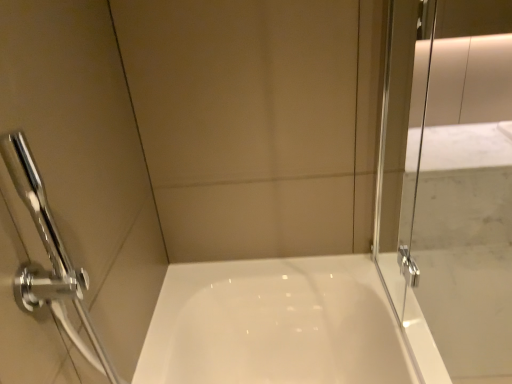
You are a GUI agent. You are given a task and a screenshot of the screen. Output one action in this format:
    pyautogui.click(x=<x>, y=<y>)
    Task: Click on the transparent glass screen door at right
    This screenshot has width=512, height=384.
    Given the screenshot: What is the action you would take?
    coord(448,194)

What do you see at coordinates (448, 194) in the screenshot?
I see `transparent glass screen door at right` at bounding box center [448, 194].

Describe the element at coordinates (49, 256) in the screenshot. This screenshot has height=384, width=512. I see `chrome metallic showerhead at left` at that location.

This screenshot has width=512, height=384. In order to click on chrome metallic showerhead at left in this screenshot , I will do `click(49, 256)`.

Where is `transparent glass screen door at right`? transparent glass screen door at right is located at coordinates (448, 194).

Considering the relative positions of transparent glass screen door at right and chrome metallic showerhead at left in the image provided, is transparent glass screen door at right to the left or to the right of chrome metallic showerhead at left?

Clearly, transparent glass screen door at right is on the right of chrome metallic showerhead at left in the image.

Which object is further away from the camera taking this photo, transparent glass screen door at right or chrome metallic showerhead at left?

chrome metallic showerhead at left is further from the camera.

Which is in front, point (435, 51) or point (42, 272)?

Positioned in front is point (42, 272).

From the image's perspective, is transparent glass screen door at right beneath chrome metallic showerhead at left?

No.

From a real-world perspective, relative to chrome metallic showerhead at left, is transparent glass screen door at right vertically above or below?

Clearly, from a real-world perspective, transparent glass screen door at right is above chrome metallic showerhead at left.

Considering the relative sizes of transparent glass screen door at right and chrome metallic showerhead at left in the image provided, is transparent glass screen door at right wider than chrome metallic showerhead at left?

In fact, transparent glass screen door at right might be narrower than chrome metallic showerhead at left.

In the scene shown: Who is taller, transparent glass screen door at right or chrome metallic showerhead at left?

With more height is transparent glass screen door at right.

Which of these two, transparent glass screen door at right or chrome metallic showerhead at left, is smaller?

chrome metallic showerhead at left is smaller.

Can chrome metallic showerhead at left be found inside transparent glass screen door at right?

No, chrome metallic showerhead at left is not inside transparent glass screen door at right.

Is transparent glass screen door at right next to chrome metallic showerhead at left and touching it?

transparent glass screen door at right is not next to chrome metallic showerhead at left, and they're not touching.

In the scene shown: Is transparent glass screen door at right turned away from chrome metallic showerhead at left?

Yes, chrome metallic showerhead at left is at the back of transparent glass screen door at right.

Find the location of `screen door above the chrome metallic showerhead at left (from the image's perspective)`. screen door above the chrome metallic showerhead at left (from the image's perspective) is located at coordinates (448, 194).

Is chrome metallic showerhead at left at the left side of transparent glass screen door at right?

Indeed, chrome metallic showerhead at left is positioned on the left side of transparent glass screen door at right.

Which object is more forward, chrome metallic showerhead at left or transparent glass screen door at right?

Positioned in front is transparent glass screen door at right.

Considering the positions of point (27, 200) and point (392, 5), is point (27, 200) closer or farther from the camera than point (392, 5)?

Clearly, point (27, 200) is closer to the camera than point (392, 5).

From the image's perspective, which is below, chrome metallic showerhead at left or transparent glass screen door at right?

From the image's view, chrome metallic showerhead at left is below.

From a real-world perspective, between chrome metallic showerhead at left and transparent glass screen door at right, who is vertically lower?

From a 3D spatial view, chrome metallic showerhead at left is below.

Considering the relative sizes of chrome metallic showerhead at left and transparent glass screen door at right in the image provided, is chrome metallic showerhead at left wider than transparent glass screen door at right?

Correct, the width of chrome metallic showerhead at left exceeds that of transparent glass screen door at right.

Considering the sizes of objects chrome metallic showerhead at left and transparent glass screen door at right in the image provided, who is taller, chrome metallic showerhead at left or transparent glass screen door at right?

With more height is transparent glass screen door at right.

Who is bigger, chrome metallic showerhead at left or transparent glass screen door at right?

transparent glass screen door at right is bigger.

Is transparent glass screen door at right surrounded by chrome metallic showerhead at left?

No, transparent glass screen door at right is located outside of chrome metallic showerhead at left.

Is chrome metallic showerhead at left far away from transparent glass screen door at right?

No, chrome metallic showerhead at left is not far away from transparent glass screen door at right.

Is chrome metallic showerhead at left turned away from transparent glass screen door at right?

No, chrome metallic showerhead at left is not facing the opposite direction of transparent glass screen door at right.

Can you tell me how much chrome metallic showerhead at left and transparent glass screen door at right differ in facing direction?

0.403 degrees.

At what (x,y) coordinates should I click in order to perform the action: click on screen door in front of the chrome metallic showerhead at left. Please return your answer as a coordinate pair (x, y). Looking at the image, I should click on (448, 194).

The width and height of the screenshot is (512, 384). Identify the location of screen door on the right of chrome metallic showerhead at left. (448, 194).

Locate an element on the screen. shower that is behind the transparent glass screen door at right is located at coordinates (49, 256).